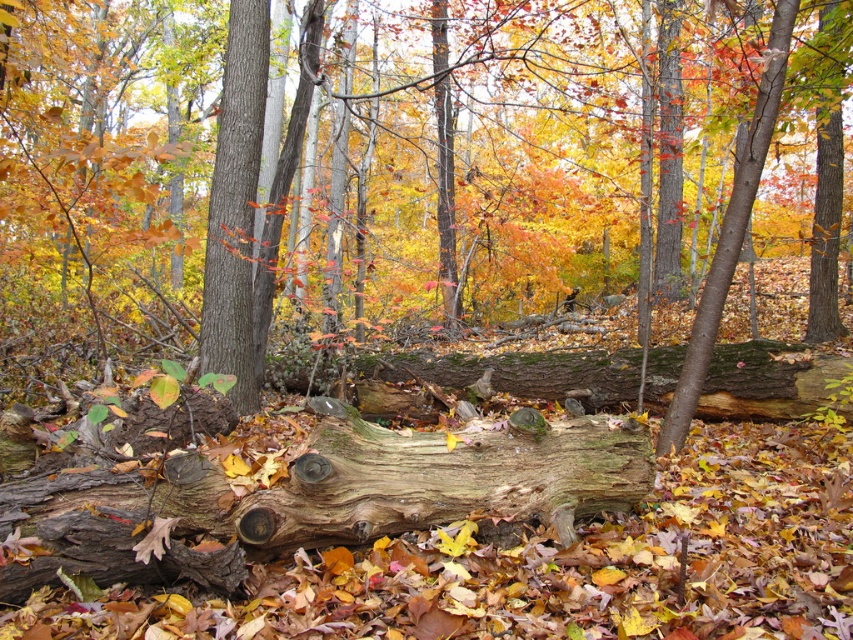
Is weathered wood log at center positioned before smooth brown tree trunk at center?

Yes, weathered wood log at center is in front of smooth brown tree trunk at center.

Is weathered wood log at center above smooth brown tree trunk at center?

No, weathered wood log at center is not above smooth brown tree trunk at center.

Does point (119, 513) lie in front of point (250, 339)?

Yes, it is in front of point (250, 339).

You are a GUI agent. You are given a task and a screenshot of the screen. Output one action in this format:
    pyautogui.click(x=<x>, y=<y>)
    Task: Click on the weathered wood log at center
    
    Given the screenshot: What is the action you would take?
    pyautogui.click(x=317, y=497)